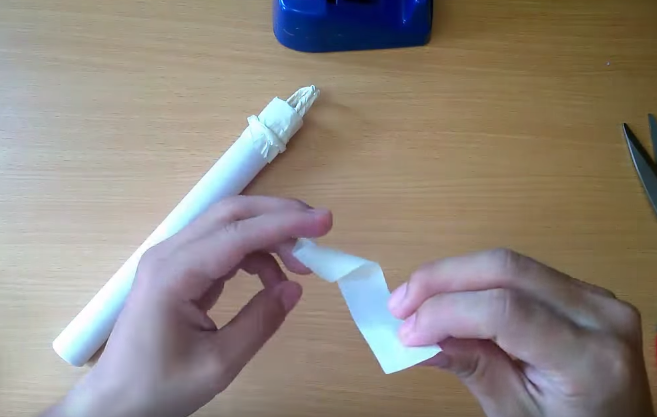
Image resolution: width=657 pixels, height=417 pixels. Identify the location of blue stapler. (382, 27).